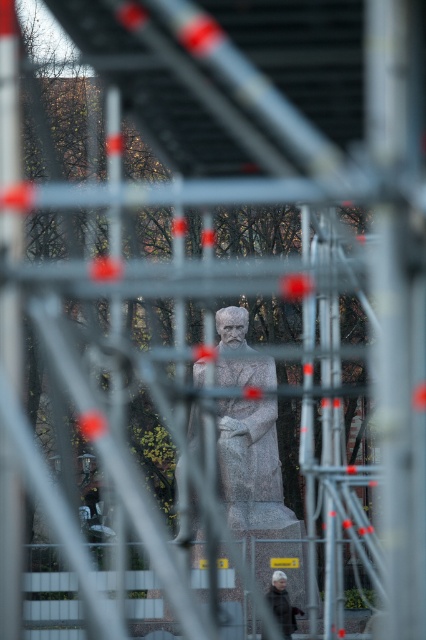
You are standing near the metal barrier with red and white markings in the foreground of the park scene. You want to place a 5 meter long ladder between the granite statue at center and the gray woolen coat at lower center. Will the ladder fit between them?

The distance between the granite statue at center and the gray woolen coat at lower center is 4.64 meters. Since the ladder is 5 meters long, it will not fit between them as it is longer than the available space.

You are a visitor at the park and want to take a clear photo of the granite statue at center. However, there is a gray woolen coat at lower center blocking your view. Can you suggest a way to avoid the obstruction?

The granite statue at center is shorter than the gray woolen coat at lower center, so you can try moving to a higher position or angle your camera upwards to capture the statue above the gray woolen coat at lower center.